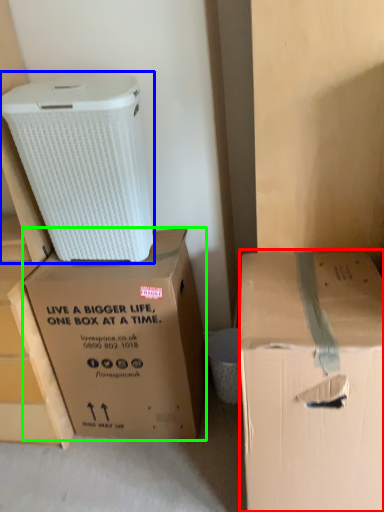
Question: Which is nearer to the box (highlighted by a red box)? cardboard box (highlighted by a blue box) or box (highlighted by a green box).

Choices:
 (A) cardboard box
 (B) box

Answer: (B)